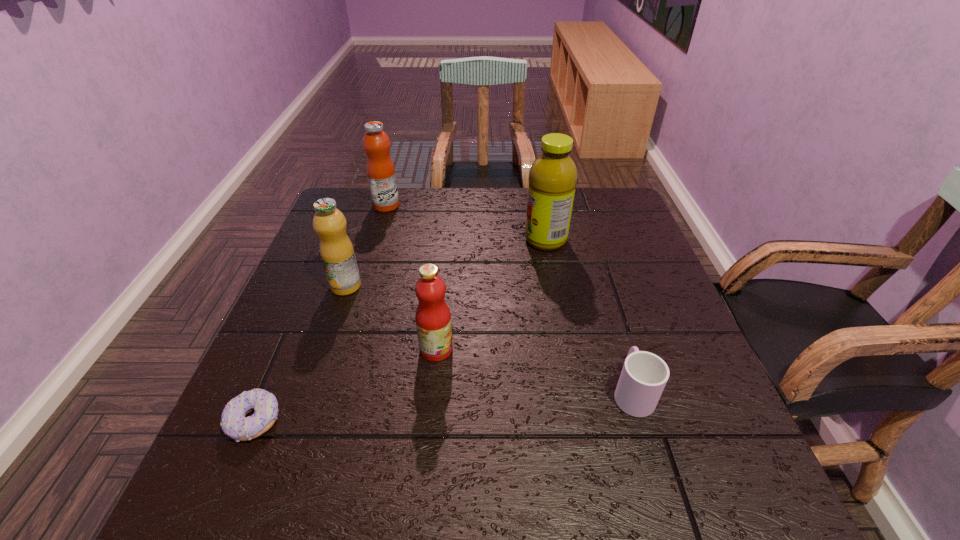
Select which fruit juice is the second closest to the fourth object from left to right. Please provide its 2D coordinates. Your answer should be formatted as a tuple, i.e. [(x, y)], where the tuple contains the x and y coordinates of a point satisfying the conditions above.

[(553, 175)]

Locate an element on the screen. This screenshot has width=960, height=540. vacant region that satisfies the following two spatial constraints: 1. on the front label of the farthest object; 2. on the front label of the third farthest object is located at coordinates (362, 286).

The image size is (960, 540). Identify the location of vacant position in the image that satisfies the following two spatial constraints: 1. on the front label of the farthest object; 2. with the handle on the side of the second shortest object. (330, 392).

Identify the location of free point that satisfies the following two spatial constraints: 1. with the handle on the side of the cup; 2. on the front label of the third object from right to left. Image resolution: width=960 pixels, height=540 pixels. (619, 349).

Where is `vacant space that satisfies the following two spatial constraints: 1. on the front label of the fourth object from left to right; 2. on the front side of the shortest object`? The height and width of the screenshot is (540, 960). vacant space that satisfies the following two spatial constraints: 1. on the front label of the fourth object from left to right; 2. on the front side of the shortest object is located at coordinates (429, 421).

Image resolution: width=960 pixels, height=540 pixels. In order to click on vacant point that satisfies the following two spatial constraints: 1. on the front label of the farthest fruit juice; 2. with the handle on the side of the rightmost object in this screenshot , I will do `click(330, 392)`.